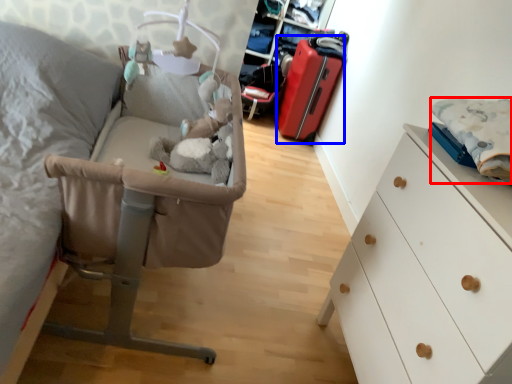
Question: Among these objects, which one is nearest to the camera, linen (highlighted by a red box) or luggage (highlighted by a blue box)?

Choices:
 (A) linen
 (B) luggage

Answer: (A)